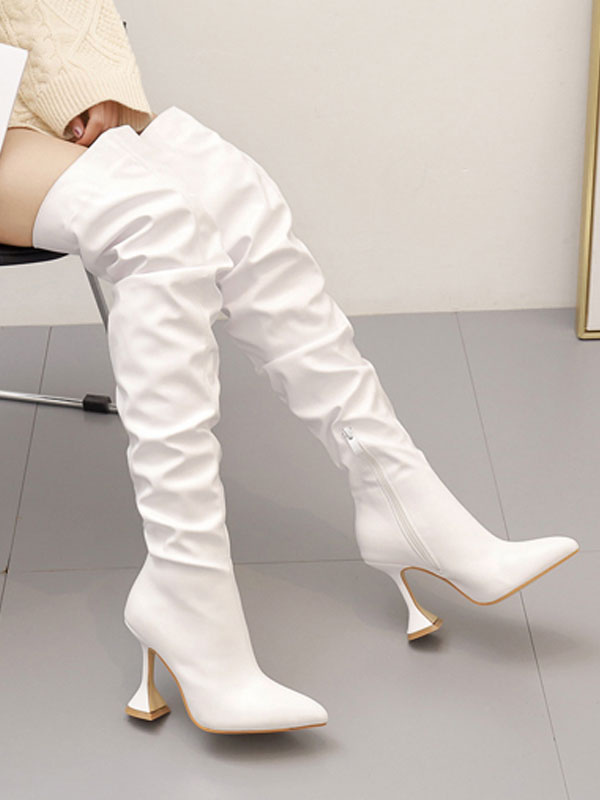
Where is `floor`? floor is located at coordinates (336, 632).